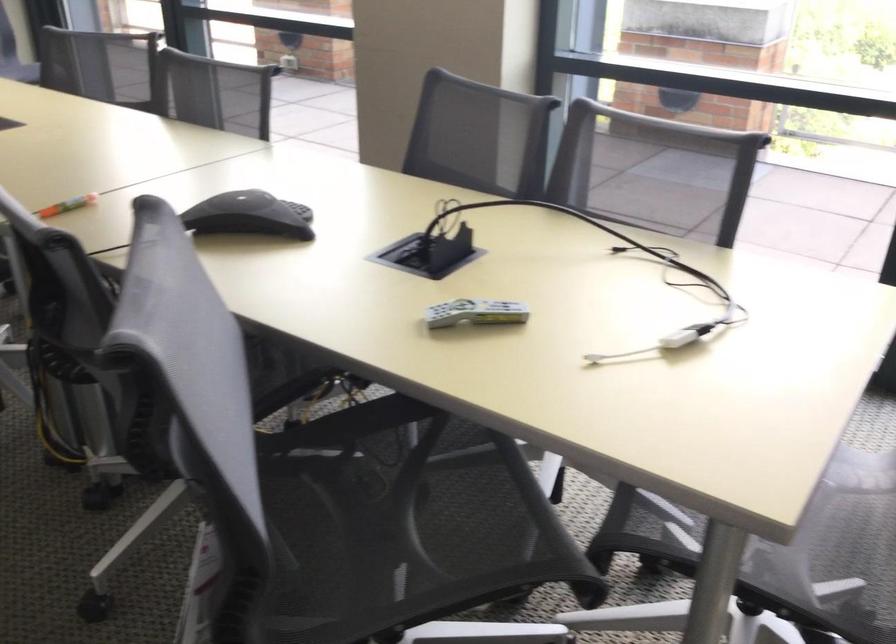
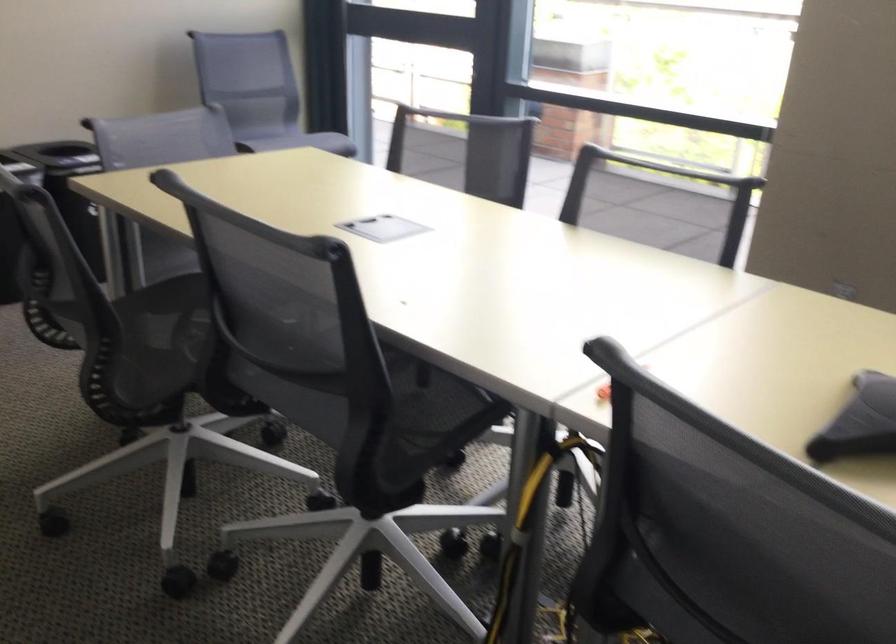
Question: The first image is from the beginning of the video and the second image is from the end. How did the camera likely rotate when shooting the video?

Choices:
 (A) Left
 (B) Right
 (C) Up
 (D) Down

Answer: (A)